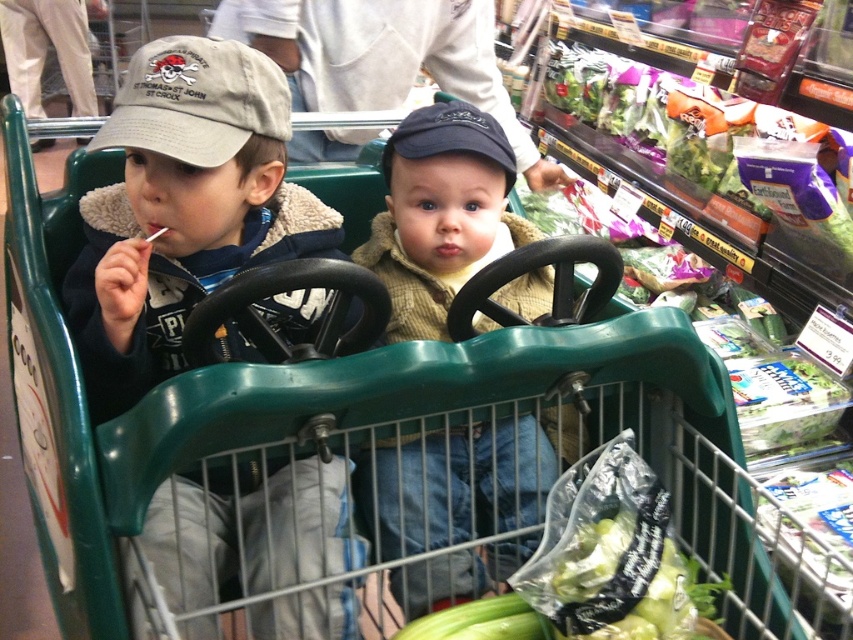
Consider the image. Is knitted beige sweater at center below green matte cucumber at lower center?

No, knitted beige sweater at center is not below green matte cucumber at lower center.

Describe the element at coordinates (440, 212) in the screenshot. This screenshot has height=640, width=853. I see `knitted beige sweater at center` at that location.

Consider the image. Who is more distant from viewer, [363,472] or [476,634]?

Positioned behind is point [363,472].

You are a GUI agent. You are given a task and a screenshot of the screen. Output one action in this format:
    pyautogui.click(x=<x>, y=<y>)
    Task: Click on the knitted beige sweater at center
    This screenshot has height=640, width=853.
    Given the screenshot: What is the action you would take?
    pyautogui.click(x=440, y=212)

Can you confirm if knitted beige sweater at center is taller than gray cotton baseball cap at upper left?

Indeed, knitted beige sweater at center has a greater height compared to gray cotton baseball cap at upper left.

Is knitted beige sweater at center shorter than gray cotton baseball cap at upper left?

No.

Between point (474, 474) and point (178, 108), which one is positioned behind?

The point (474, 474) is behind.

Locate an element on the screen. The image size is (853, 640). knitted beige sweater at center is located at coordinates (440, 212).

The width and height of the screenshot is (853, 640). Describe the element at coordinates (183, 209) in the screenshot. I see `matte khaki cap at center` at that location.

Which is behind, point (206, 77) or point (590, 579)?

Positioned behind is point (206, 77).

Who is more distant from viewer, (264, 150) or (511, 611)?

Point (264, 150)

Identify the location of matte khaki cap at center. The width and height of the screenshot is (853, 640). (183, 209).